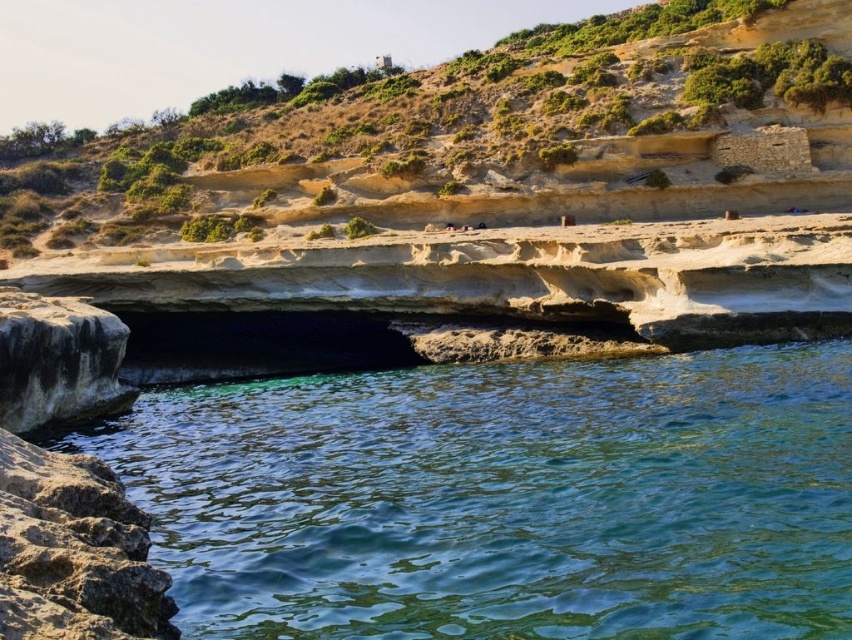
You are a photographer planning to capture the rustic stone cliff at center and the rough textured rock at lower left in a single frame. Given that your camera can only focus on objects within a 10 meter width, will both objects fit within the frame?

The rustic stone cliff at center is wider than the rough textured rock at lower left. Since the camera can focus on objects within a 10 meter width, but the total combined width of both objects would exceed the frame if their individual widths add up to more than 10 meters. However, the description only states the cliff is wider, not their exact measurements. Without specific widths, it is impossible to determine if they both fit within the 10 meter limit.

You are standing at the edge of the coastal landscape and want to cross from the clear water at lower center to the brown rough stone at upper right. Which path would require moving a shorter distance horizontally?

The clear water at lower center is wider than the brown rough stone at upper right, so moving horizontally across the clear water at lower center would require a longer distance compared to the brown rough stone at upper right. Therefore, the path to the brown rough stone at upper right requires a shorter horizontal distance.

You are standing on the shore looking at the clear water at lower center and the rough textured rock at lower left. Which object is closer to your right side?

The clear water at lower center is to the right of rough textured rock at lower left, so the clear water at lower center is closer to your right side.